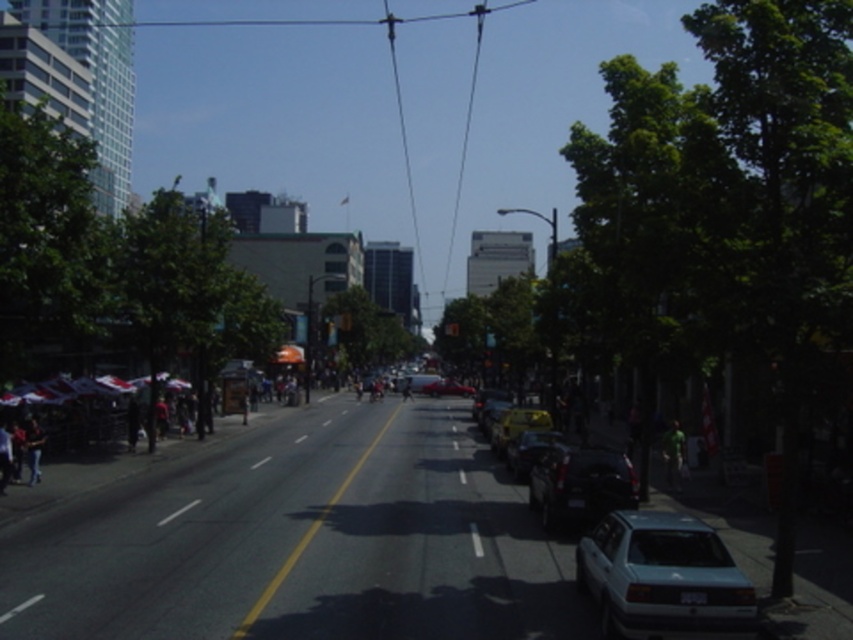
You are standing at the point labeled point [538,422] and want to walk to the point labeled point [659,515]. Which direction should you move relative to the street layout?

You should move forward along the street towards the point labeled point [659,515] because it is in front of your current position at point [538,422].

You are standing at the starting point in the middle of the road looking down the street. There are two points marked on the ground ahead of you. The first point is at coordinates point (608, 467) and the second is at point (306, 545). Which point is closer to your current position?

Point (306, 545) is closer to your current position because it is nearer to the camera compared to point (608, 467), which is further away.